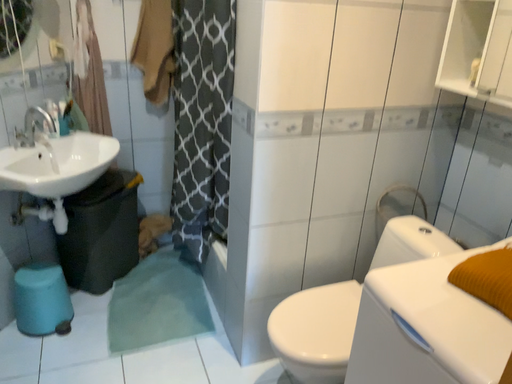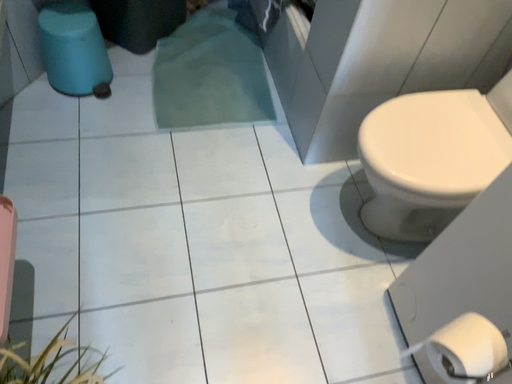
Question: Which way did the camera rotate in the video?

Choices:
 (A) rotated upward
 (B) rotated downward

Answer: (B)